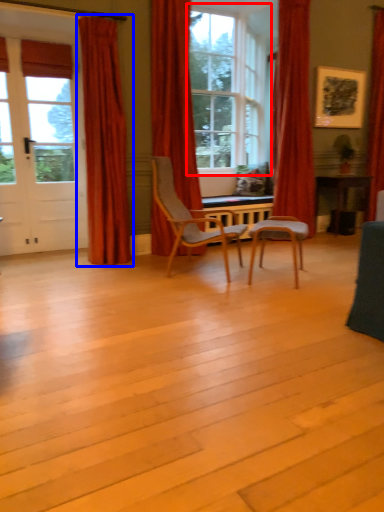
Question: Which object is further to the camera taking this photo, window (highlighted by a red box) or curtain (highlighted by a blue box)?

Choices:
 (A) window
 (B) curtain

Answer: (A)